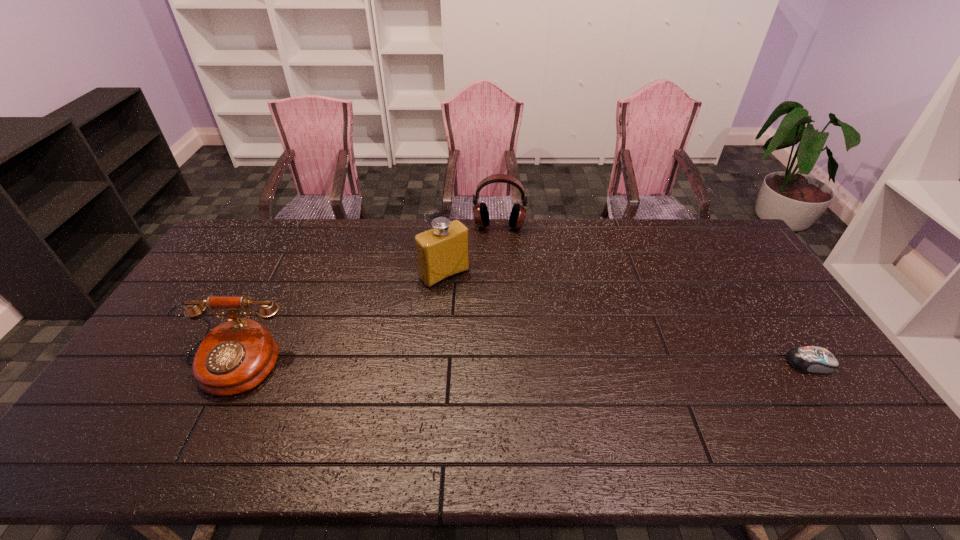
In the image, there is a desktop. Where is `vacant space at the left edge`? vacant space at the left edge is located at coordinates (217, 272).

I want to click on blank area at the right edge, so click(728, 284).

At what (x,y) coordinates should I click in order to perform the action: click on free area in between the rightmost object and the headset. Please return your answer as a coordinate pair (x, y). This screenshot has width=960, height=540. Looking at the image, I should click on (655, 295).

The width and height of the screenshot is (960, 540). What are the coordinates of `vacant space that's between the shortest object and the second object from right to left` in the screenshot? It's located at (655, 295).

The width and height of the screenshot is (960, 540). Find the location of `vacant space in between the telephone and the second farthest object`. vacant space in between the telephone and the second farthest object is located at coordinates (337, 320).

Where is `vacant space that's between the tallest object and the second object from right to left`? Image resolution: width=960 pixels, height=540 pixels. vacant space that's between the tallest object and the second object from right to left is located at coordinates (471, 251).

The height and width of the screenshot is (540, 960). I want to click on empty location between the rightmost object and the third object from right to left, so click(x=627, y=319).

This screenshot has width=960, height=540. I want to click on unoccupied area between the shortest object and the second object from left to right, so click(627, 319).

I want to click on vacant area that lies between the second farthest object and the third object from left to right, so click(471, 251).

Locate an element on the screen. This screenshot has width=960, height=540. unoccupied area between the tallest object and the shortest object is located at coordinates (627, 319).